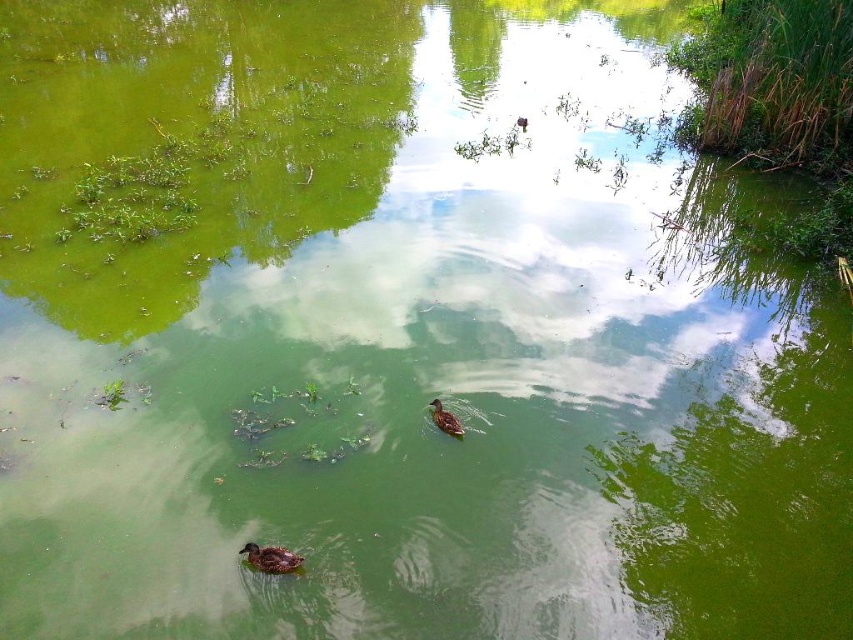
Question: Which point is farther from the camera taking this photo?

Choices:
 (A) (270, 570)
 (B) (440, 404)

Answer: (B)

Question: Is brown fuzzy duckling at lower left above brown feathered duck at center?

Choices:
 (A) no
 (B) yes

Answer: (A)

Question: Is brown fuzzy duckling at lower left above brown feathered duck at center?

Choices:
 (A) yes
 (B) no

Answer: (B)

Question: Among these objects, which one is farthest from the camera?

Choices:
 (A) brown fuzzy duckling at lower left
 (B) brown feathered duck at center

Answer: (B)

Question: Does brown fuzzy duckling at lower left lie in front of brown feathered duck at center?

Choices:
 (A) no
 (B) yes

Answer: (B)